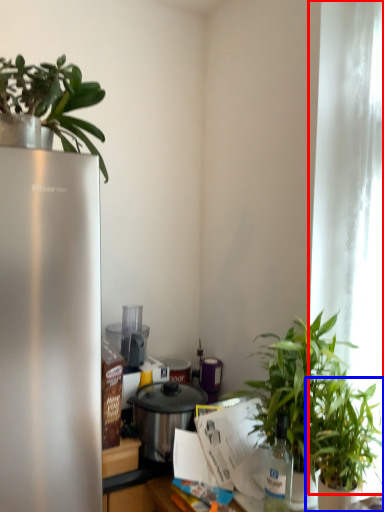
Question: Which object appears farthest to the camera in this image, window screen (highlighted by a red box) or houseplant (highlighted by a blue box)?

Choices:
 (A) window screen
 (B) houseplant

Answer: (A)